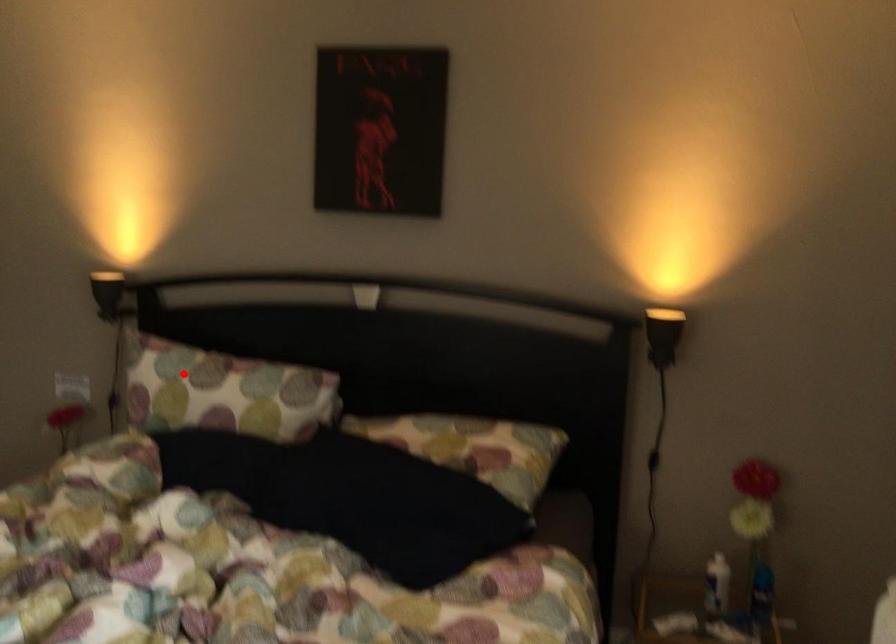
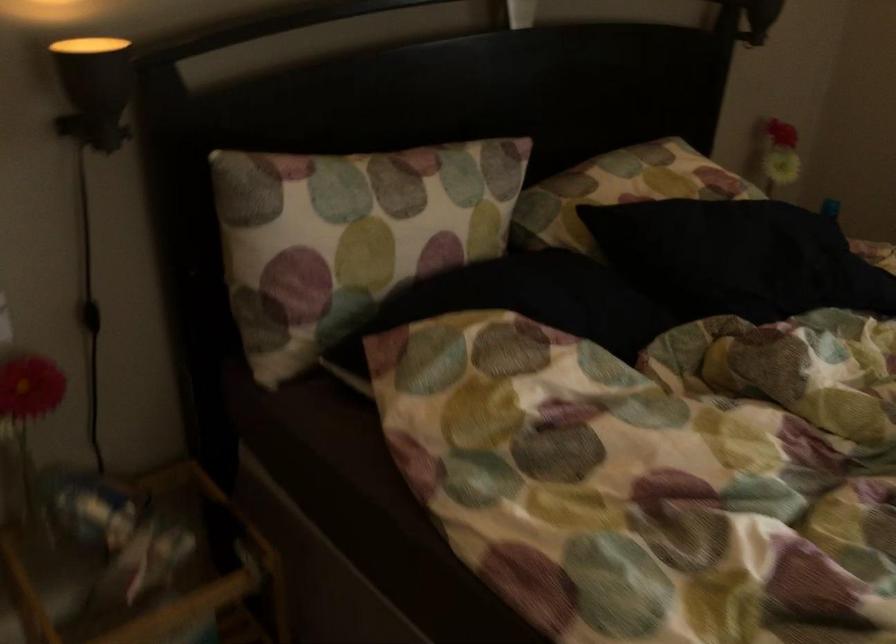
Question: I am providing you with two images of the same scene from different viewpoints. Image1 has a red point marked. In image2, the corresponding 3D location appears at what relative position? Reply with the corresponding letter.

Choices:
 (A) Closer
 (B) Farther

Answer: (A)